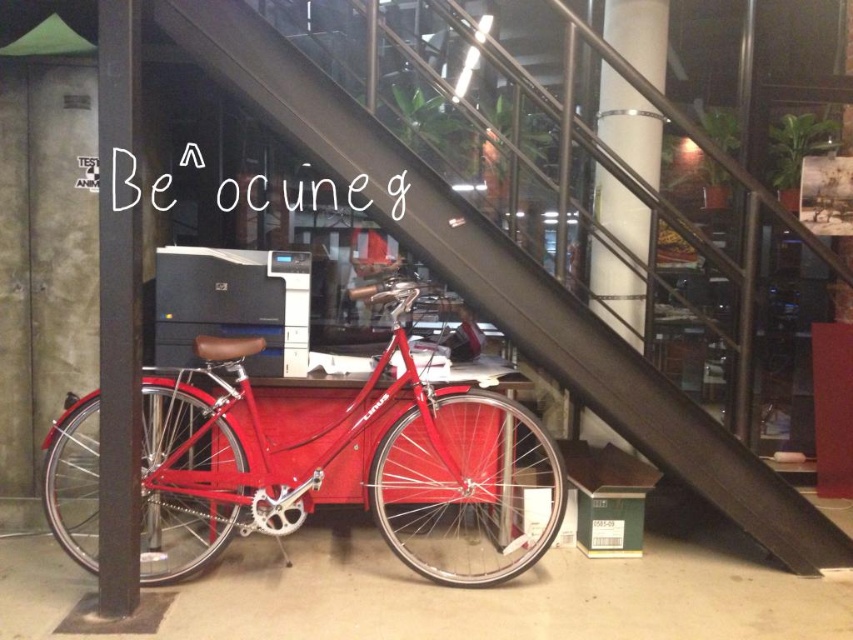
Does metallic staircase at center appear over metallic gray pole at left?

Correct, metallic staircase at center is located above metallic gray pole at left.

Consider the image. Is metallic staircase at center positioned before metallic gray pole at left?

No, metallic staircase at center is behind metallic gray pole at left.

I want to click on metallic staircase at center, so click(x=503, y=282).

The image size is (853, 640). Identify the location of metallic staircase at center. (503, 282).

Consider the image. Who is taller, glossy red bicycle at center or metallic staircase at center?

With more height is metallic staircase at center.

Which of these two, glossy red bicycle at center or metallic staircase at center, stands shorter?

Standing shorter between the two is glossy red bicycle at center.

This screenshot has height=640, width=853. Identify the location of glossy red bicycle at center. (367, 474).

In order to click on glossy red bicycle at center in this screenshot , I will do `click(367, 474)`.

Which of these two, glossy red bicycle at center or metallic gray pole at left, stands taller?

Standing taller between the two is metallic gray pole at left.

Who is more forward, [451,419] or [103,227]?

Point [103,227] is in front.

Is point (360, 403) positioned before point (105, 548)?

No, (360, 403) is behind (105, 548).

This screenshot has width=853, height=640. I want to click on glossy red bicycle at center, so click(367, 474).